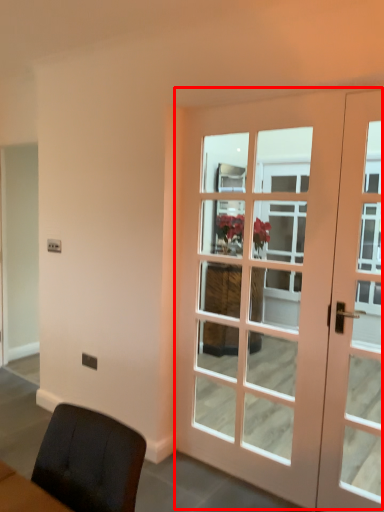
Question: From the image, what is the correct spatial relationship of door (annotated by the red box) in relation to door?

Choices:
 (A) right
 (B) left

Answer: (B)